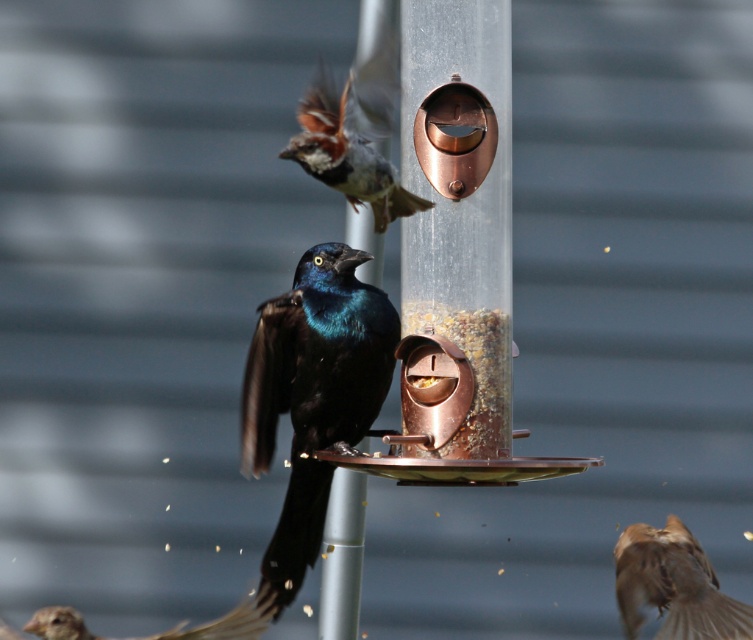
Between brown speckled feathers at upper center and brown fluffy sparrow at lower right, which one has less height?

Standing shorter between the two is brown fluffy sparrow at lower right.

Is point (358, 96) positioned before point (681, 609)?

No, it is not.

Find the location of `brown speckled feathers at upper center`. brown speckled feathers at upper center is located at coordinates (352, 140).

Between brown fluffy sparrow at lower right and metallic silver pole at center, which one appears on the left side from the viewer's perspective?

From the viewer's perspective, metallic silver pole at center appears more on the left side.

Does brown fluffy sparrow at lower right have a lesser height compared to metallic silver pole at center?

Indeed, brown fluffy sparrow at lower right has a lesser height compared to metallic silver pole at center.

You are a GUI agent. You are given a task and a screenshot of the screen. Output one action in this format:
    pyautogui.click(x=<x>, y=<y>)
    Task: Click on the brown fluffy sparrow at lower right
    This screenshot has height=640, width=753.
    Given the screenshot: What is the action you would take?
    pyautogui.click(x=672, y=586)

Between brown speckled feathers at upper center and brown feathered sparrow at lower left, which one appears on the left side from the viewer's perspective?

brown feathered sparrow at lower left

You are a GUI agent. You are given a task and a screenshot of the screen. Output one action in this format:
    pyautogui.click(x=<x>, y=<y>)
    Task: Click on the brown speckled feathers at upper center
    This screenshot has width=753, height=640.
    Given the screenshot: What is the action you would take?
    pyautogui.click(x=352, y=140)